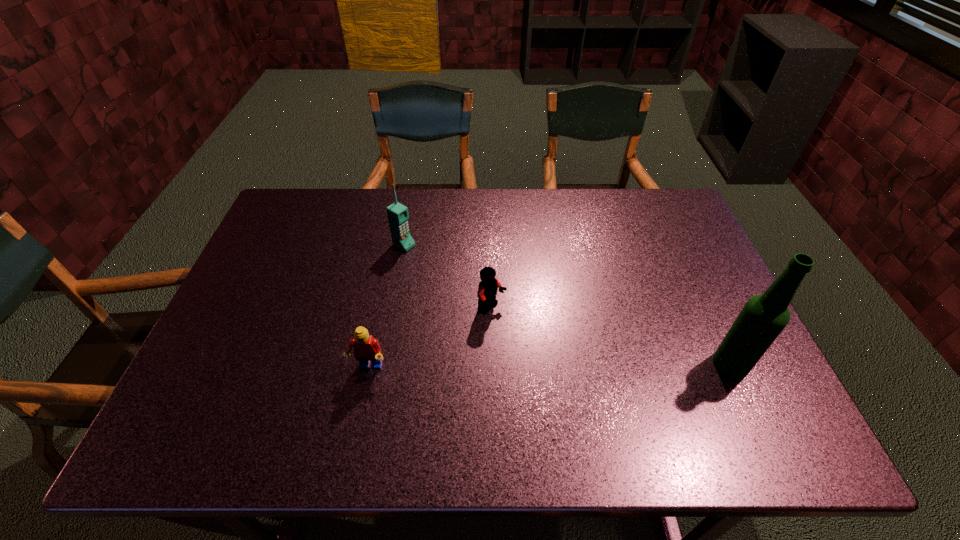
At what (x,y) coordinates should I click in order to perform the action: click on the nearer Lego. Please return your answer as a coordinate pair (x, y). This screenshot has height=540, width=960. Looking at the image, I should click on (366, 348).

I want to click on the rightmost object, so click(763, 317).

Where is `the tallest object`? the tallest object is located at coordinates (x=763, y=317).

You are a GUI agent. You are given a task and a screenshot of the screen. Output one action in this format:
    pyautogui.click(x=<x>, y=<y>)
    Task: Click on the farthest object
    The height and width of the screenshot is (540, 960).
    Given the screenshot: What is the action you would take?
    pyautogui.click(x=397, y=213)

Where is `cellular telephone`? cellular telephone is located at coordinates (397, 213).

You are a GUI agent. You are given a task and a screenshot of the screen. Output one action in this format:
    pyautogui.click(x=<x>, y=<y>)
    Task: Click on the right Lego
    The width and height of the screenshot is (960, 540).
    Given the screenshot: What is the action you would take?
    pyautogui.click(x=487, y=290)

Where is `the farther Lego`? The width and height of the screenshot is (960, 540). the farther Lego is located at coordinates (487, 290).

You are a GUI agent. You are given a task and a screenshot of the screen. Output one action in this format:
    pyautogui.click(x=<x>, y=<y>)
    Task: Click on the free space located on the front-facing side of the left Lego
    
    Given the screenshot: What is the action you would take?
    pos(361,400)

Where is `free space located on the keypad of the cellular telephone`? The image size is (960, 540). free space located on the keypad of the cellular telephone is located at coordinates (434, 263).

This screenshot has width=960, height=540. I want to click on free spot located 0.050m on the keypad of the cellular telephone, so click(x=424, y=257).